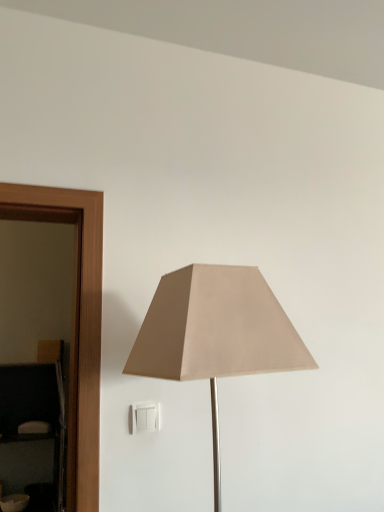
Question: Is beige fabric lamp at center shorter than matte black dresser at left?

Choices:
 (A) yes
 (B) no

Answer: (A)

Question: Is beige fabric lamp at center with matte black dresser at left?

Choices:
 (A) no
 (B) yes

Answer: (A)

Question: From the image's perspective, does beige fabric lamp at center appear lower than matte black dresser at left?

Choices:
 (A) yes
 (B) no

Answer: (B)

Question: Does beige fabric lamp at center have a lesser width compared to matte black dresser at left?

Choices:
 (A) no
 (B) yes

Answer: (A)

Question: Is beige fabric lamp at center taller than matte black dresser at left?

Choices:
 (A) yes
 (B) no

Answer: (B)

Question: Is point (251, 350) positioned closer to the camera than point (142, 420)?

Choices:
 (A) farther
 (B) closer

Answer: (B)

Question: Is beige fabric lamp at center situated inside white plastic/light switch at lower center or outside?

Choices:
 (A) outside
 (B) inside

Answer: (A)

Question: From the image's perspective, is beige fabric lamp at center located above or below white plastic/light switch at lower center?

Choices:
 (A) below
 (B) above

Answer: (B)

Question: From a real-world perspective, relative to white plastic/light switch at lower center, is beige fabric lamp at center vertically above or below?

Choices:
 (A) below
 (B) above

Answer: (B)

Question: Considering the positions of beige fabric lamp at center and matte black dresser at left in the image, is beige fabric lamp at center wider or thinner than matte black dresser at left?

Choices:
 (A) thin
 (B) wide

Answer: (B)

Question: From a real-world perspective, is beige fabric lamp at center above or below matte black dresser at left?

Choices:
 (A) below
 (B) above

Answer: (B)

Question: Relative to matte black dresser at left, is beige fabric lamp at center in front or behind?

Choices:
 (A) front
 (B) behind

Answer: (A)

Question: Is beige fabric lamp at center to the left or to the right of matte black dresser at left in the image?

Choices:
 (A) left
 (B) right

Answer: (B)

Question: Is point (61, 385) closer or farther from the camera than point (125, 371)?

Choices:
 (A) farther
 (B) closer

Answer: (A)

Question: Relative to beige fabric lamp at center, is matte black dresser at left in front or behind?

Choices:
 (A) behind
 (B) front

Answer: (A)